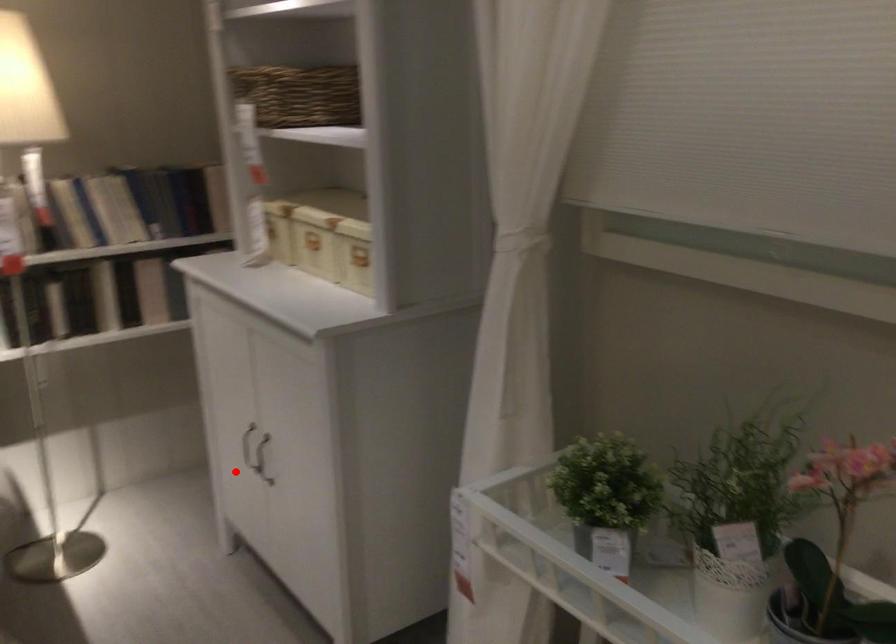
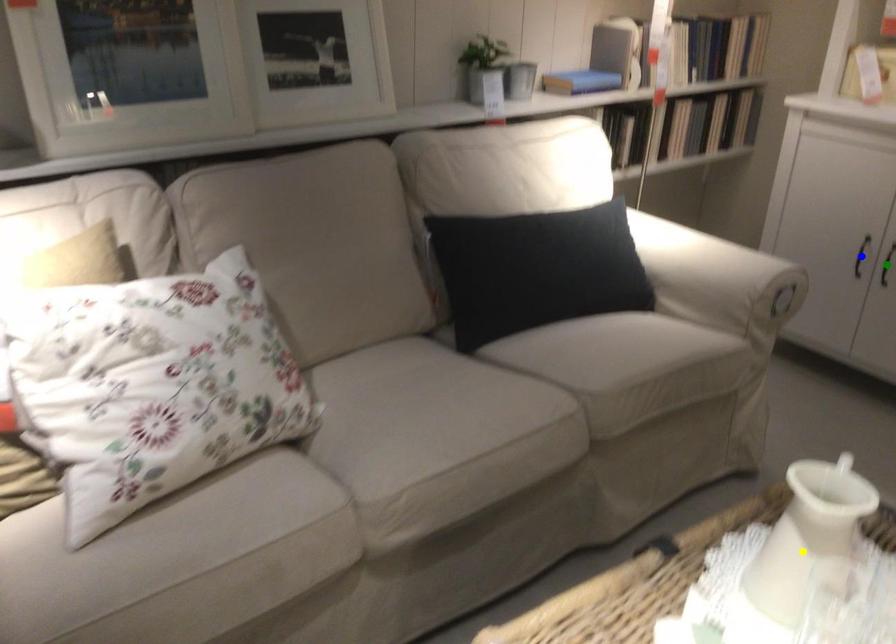
Question: I am providing you with two images of the same scene from different viewpoints. A red point is marked on the first image. You are given multiple points on the second image. Which spot in image 2 lines up with the point in image 1?

Choices:
 (A) yellow point
 (B) green point
 (C) blue point

Answer: (B)